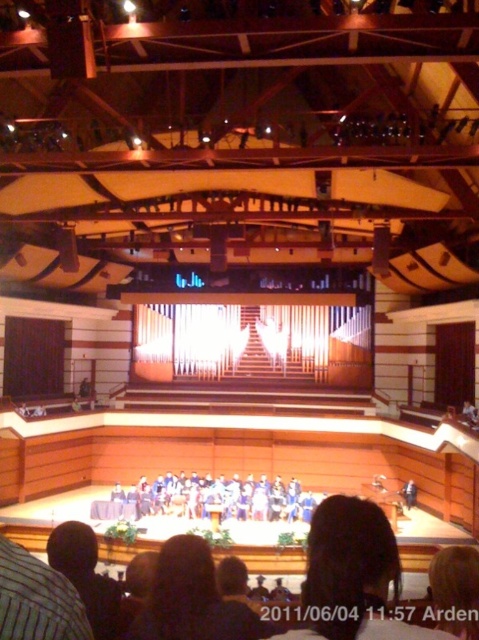
The width and height of the screenshot is (479, 640). Describe the element at coordinates (216, 499) in the screenshot. I see `blue fabric chairs at center` at that location.

Which is behind, point (174, 486) or point (69, 541)?

Point (174, 486)

Where is `blue fabric chairs at center`? Image resolution: width=479 pixels, height=640 pixels. blue fabric chairs at center is located at coordinates (216, 499).

Is the position of dark brown hair at center less distant than that of dark hair at center?

Yes.

Is point (361, 532) positioned before point (161, 618)?

That is True.

The image size is (479, 640). Identify the location of dark brown hair at center. (352, 576).

How distant is dark brown hair at center from black fabric at lower left?

11.17 feet

Can you confirm if dark brown hair at center is shorter than black fabric at lower left?

Incorrect, dark brown hair at center's height does not fall short of black fabric at lower left's.

This screenshot has width=479, height=640. Describe the element at coordinates (352, 576) in the screenshot. I see `dark brown hair at center` at that location.

Where is `dark brown hair at center`? dark brown hair at center is located at coordinates (352, 576).